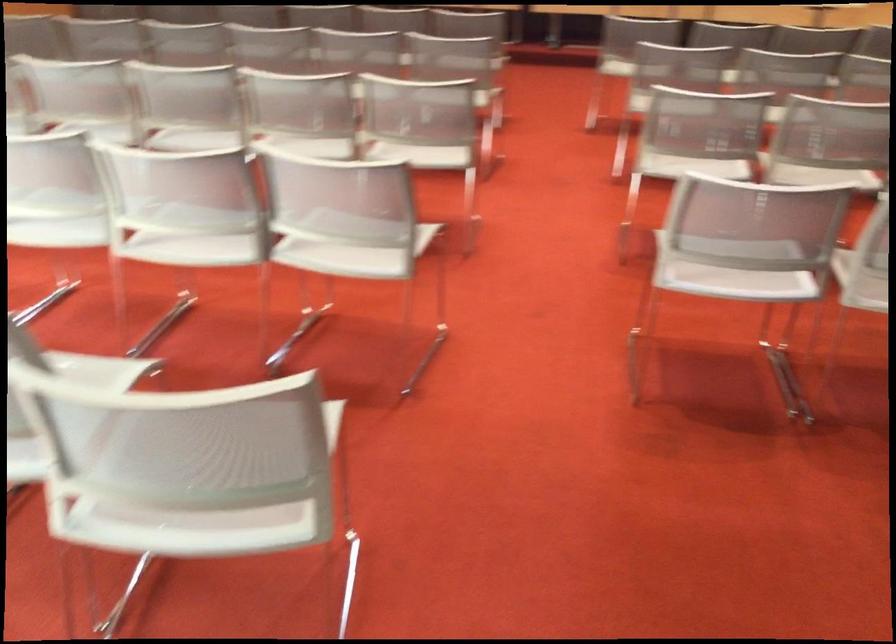
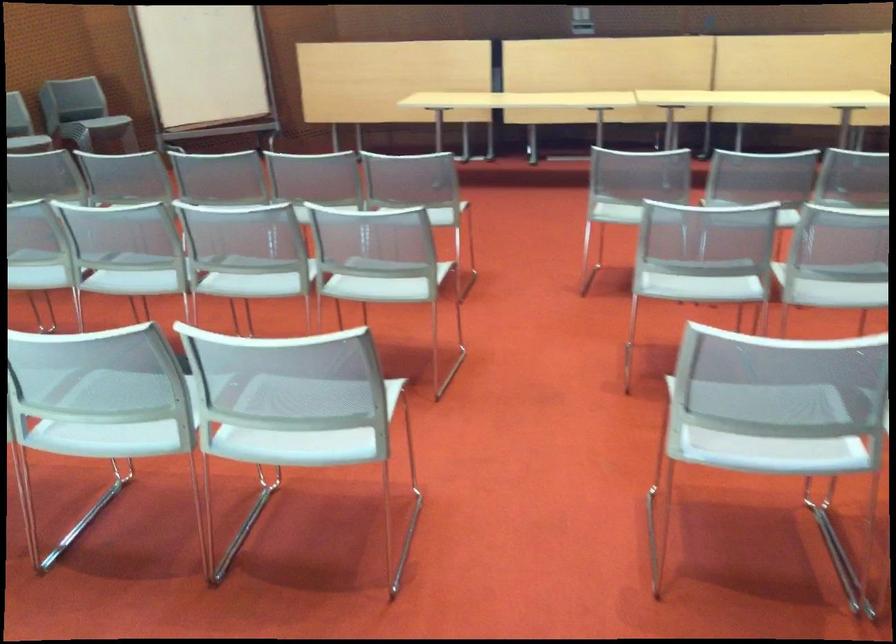
Find the pixel in the second image that matches (x=307, y=131) in the first image.

(113, 412)